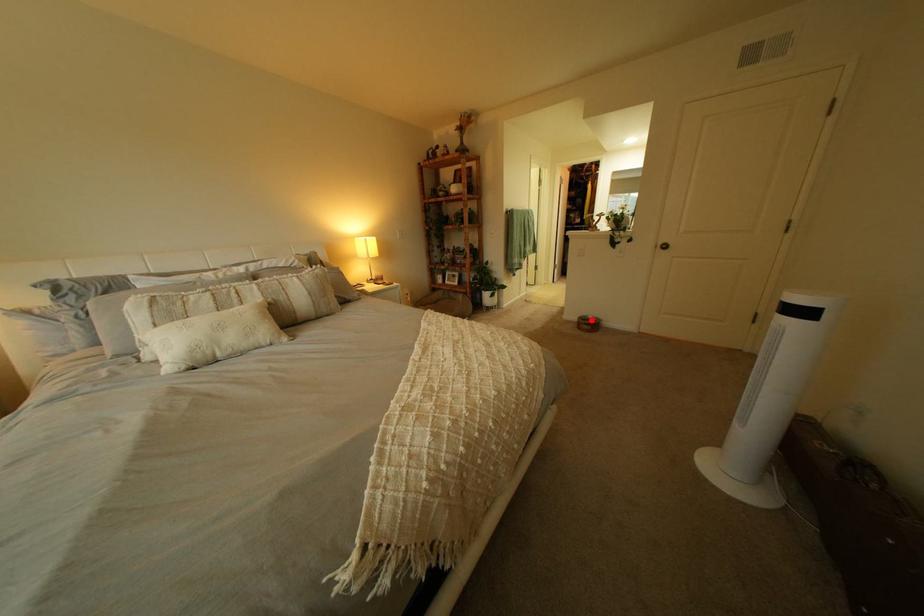
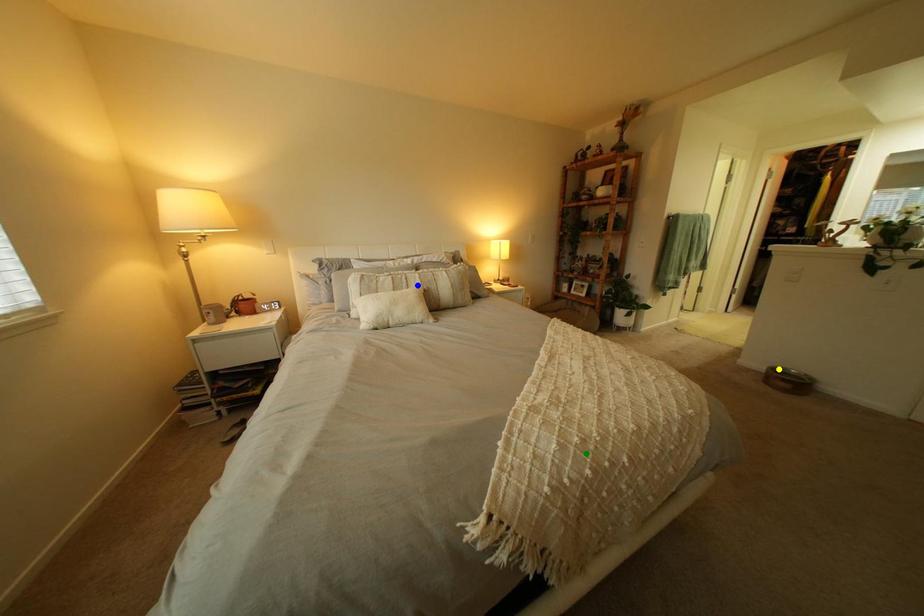
Question: I am providing you with two images of the same scene from different viewpoints. A red point is marked on the first image. You are given multiple points on the second image. Can you choose the point in image 2 that corresponds to the point in image 1?

Choices:
 (A) green point
 (B) blue point
 (C) yellow point

Answer: (C)